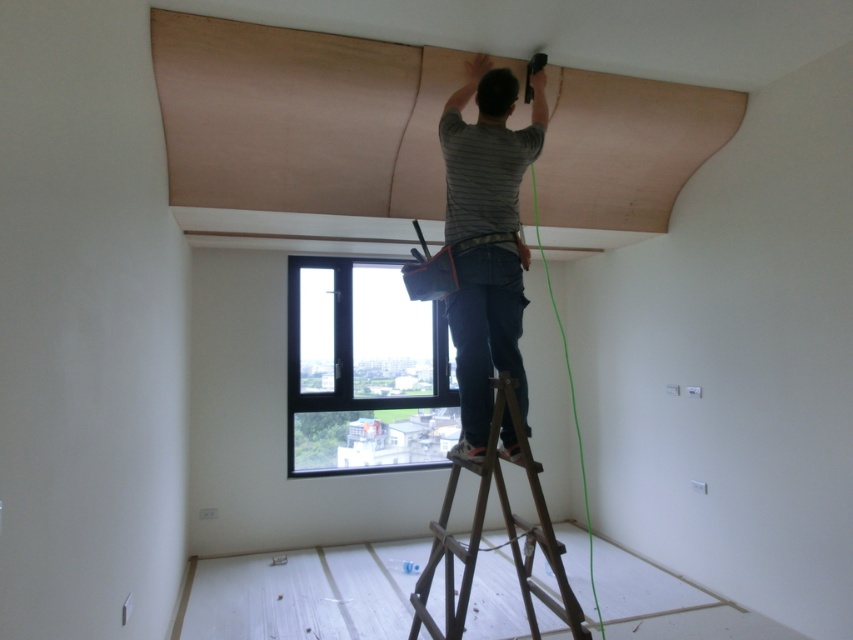
You are a contractor looking at the construction site. You need to determine if the gray striped shirt at upper center can be seen from the ground level without climbing the brown wooden ladder at center. Based on their sizes, can you infer this?

The gray striped shirt at upper center is smaller than the brown wooden ladder at center. Since the ladder is larger and likely closer to the ground, the shirt might be positioned higher up, making it less visible from the ground. However, size alone doesn

You are a contractor working in the room and need to determine the distance between two points marked on the ceiling. The points are labeled as point (323, 451) and point (520, 458). Based on their positions relative to the camera, which point is closer to the camera?

Point (323, 451) is further to the camera than point (520, 458), so point (520, 458) is closer to the camera.